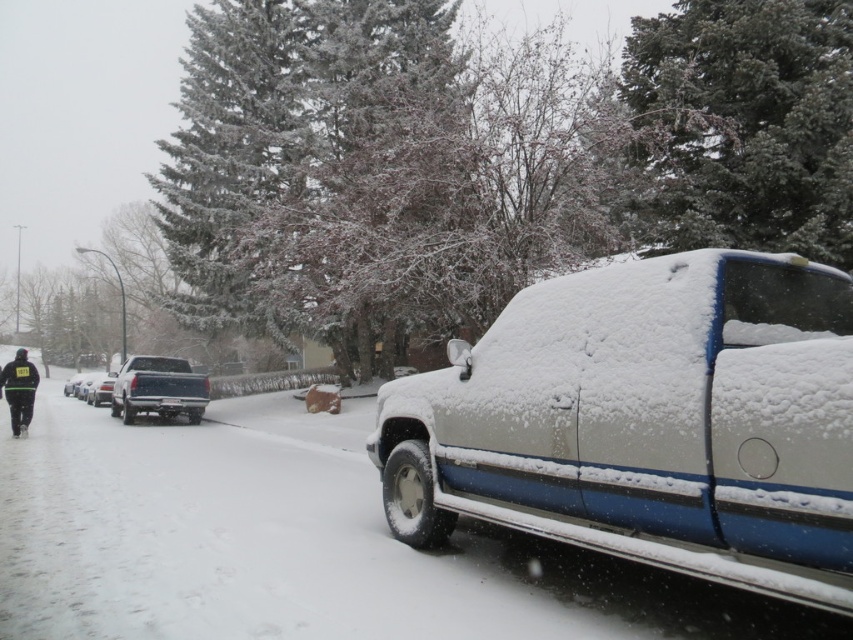
You are standing at the point marked as point (19, 390) in the snowy urban scene. What object is located at this point?

The point (19, 390) corresponds to the black fabric jacket at lower left.

You are a delivery driver needing to park your vehicle between the white matte truck at center and the silver metallic truck at center. Based on their positions, which truck should you park closer to in order to stay within the parking space?

You should park closer to the white matte truck at center because it is nearer to you than the silver metallic truck at center, so positioning your vehicle between them would require aligning closer to the nearer truck to fit within the parking space.

In the scene shown: You are a delivery person trying to decide which truck to load packages into. Both the matte black truck at center and the silver metallic truck at center are available. Based on their heights, which truck would allow you to stack taller packages without exceeding its height limit?

The matte black truck at center has a greater height compared to the silver metallic truck at center, so it can accommodate taller packages.